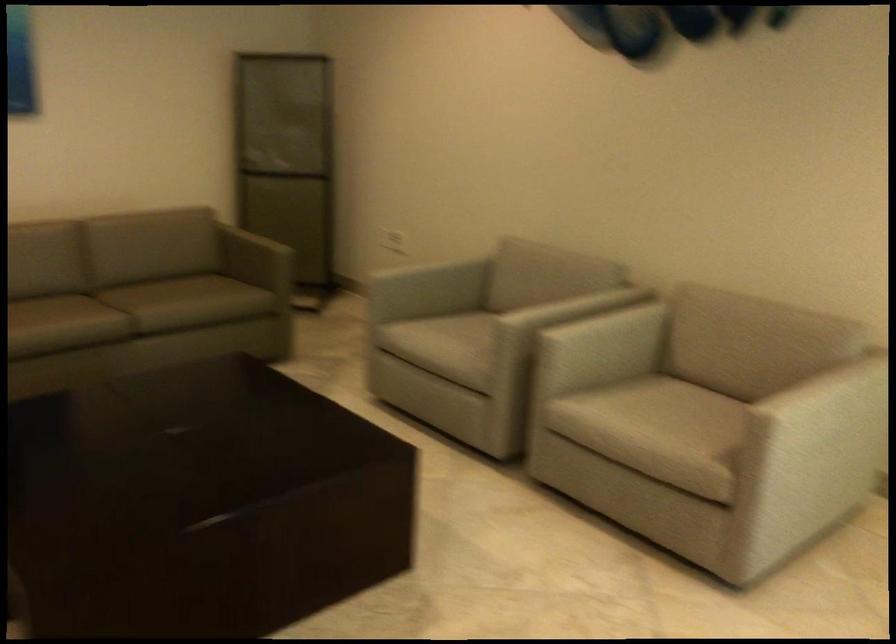
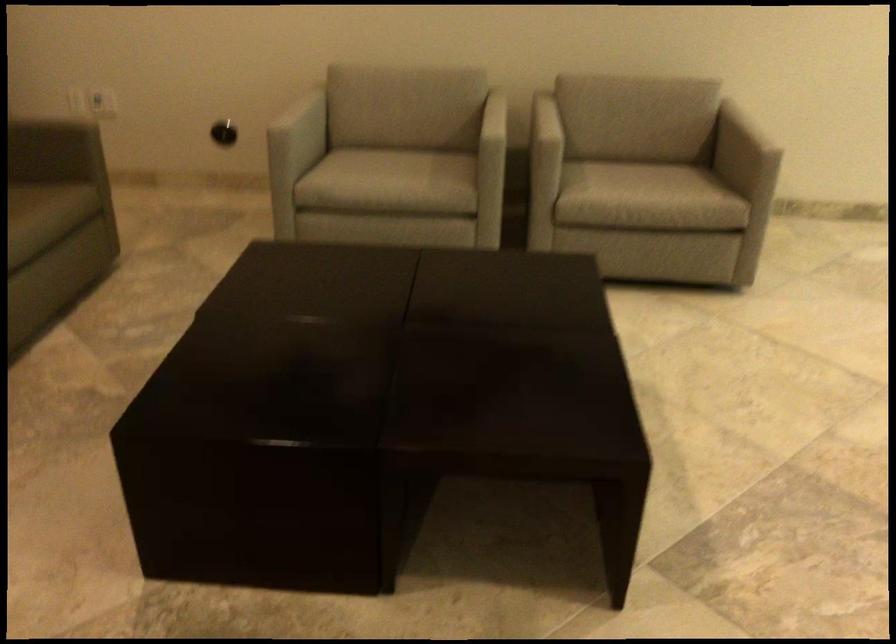
The point at (721,404) is marked in the first image. Where is the corresponding point in the second image?

(633, 160)